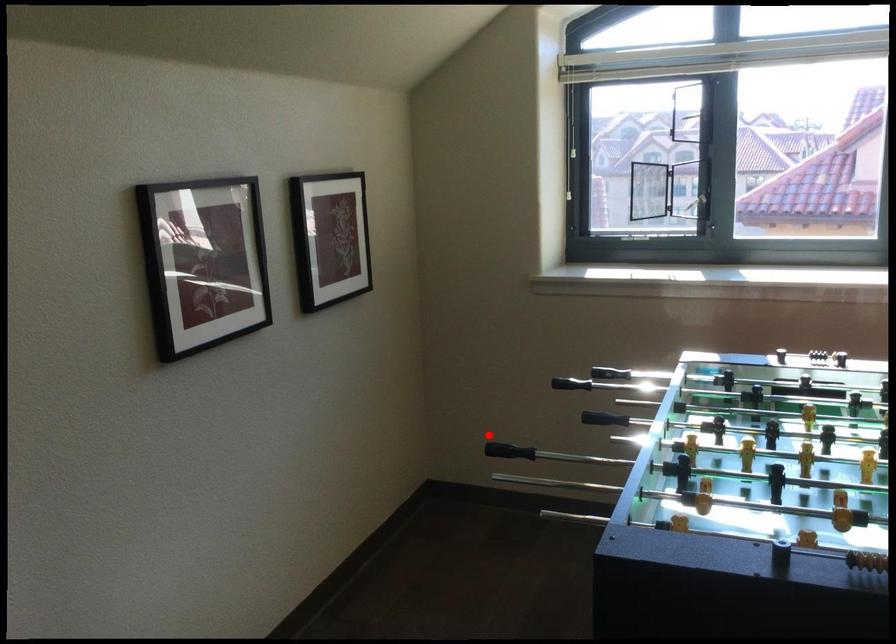
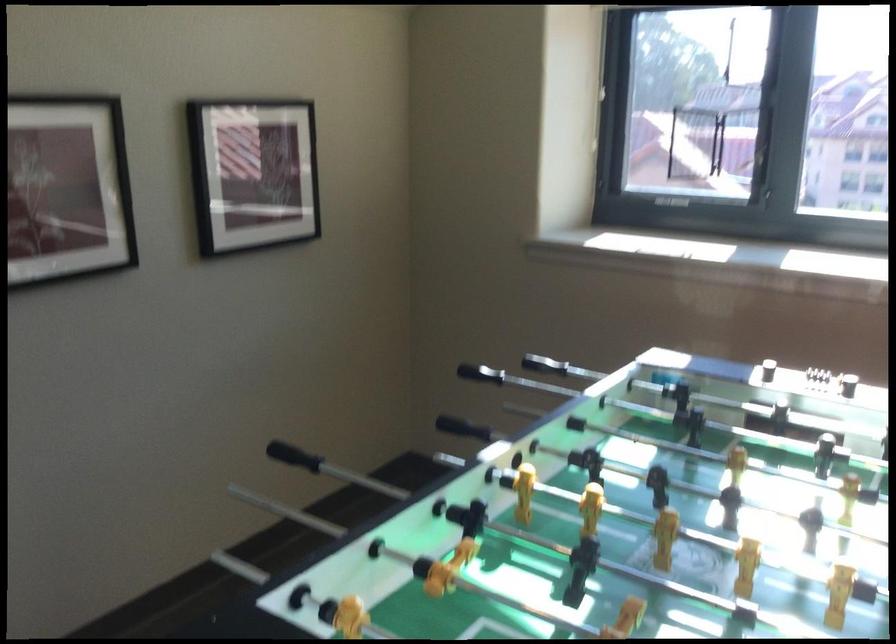
Question: I am providing you with two images of the same scene from different viewpoints. A red point is shown in image1. For the corresponding object point in image2, is it positioned nearer or farther from the camera?

Choices:
 (A) Nearer
 (B) Farther

Answer: (A)